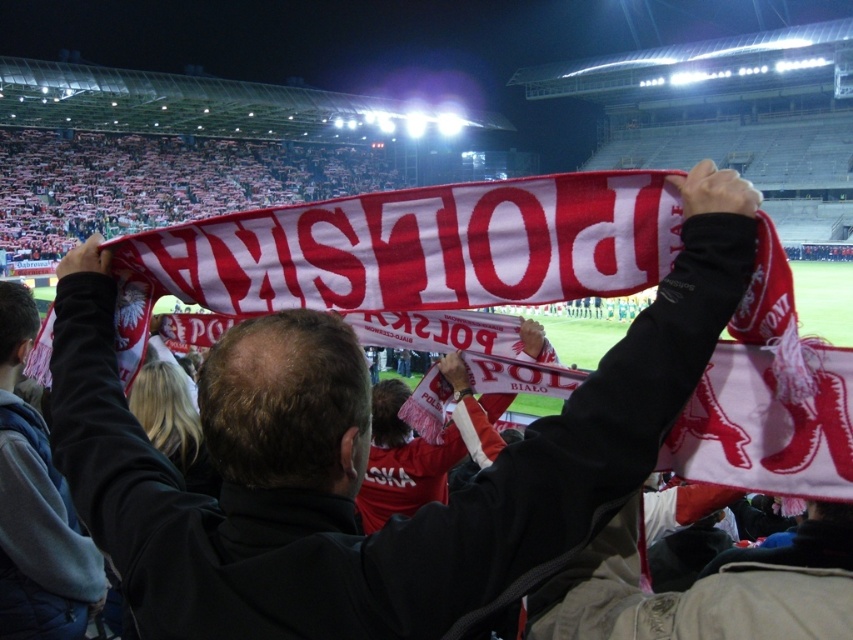
You are a photographer positioned at the front row of the stadium. You want to capture a photo of the matte red scarf at center without the gray fleece jacket at upper left blocking it. Based on their sizes, can you fit both objects in the frame while ensuring the scarf is fully visible?

The matte red scarf at center is larger in size than the gray fleece jacket at upper left. Since the scarf is bigger, you can position the camera to include both objects in the frame while ensuring the scarf remains fully visible without obstruction from the jacket.

You are a photographer at the stadium and want to capture both the matte red scarf at center and the gray fleece jacket at upper left in a single shot. Which object should you frame first to ensure both fit in the shot?

You should frame the matte red scarf at center first since it is wider than the gray fleece jacket at upper left, ensuring there is enough space for both in the shot.